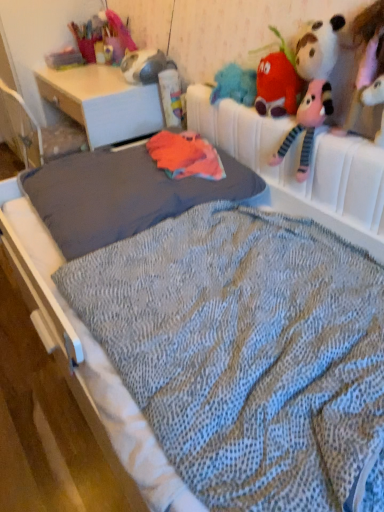
Describe the element at coordinates (278, 82) in the screenshot. I see `knitted plush strawberry at upper right, marked as the second toy in a right-to-left arrangement` at that location.

Find the location of a particular element. The height and width of the screenshot is (512, 384). matte white desk at center is located at coordinates (102, 102).

From the image's perspective, would you say knitted plush strawberry at upper right, which appears as the 2th toy when viewed from the front, is shown under gray fabric mattress at center?

Incorrect, from the image's perspective, knitted plush strawberry at upper right, which appears as the 2th toy when viewed from the front, is higher than gray fabric mattress at center.

Considering the relative positions of knitted plush strawberry at upper right, which appears as the 2th toy when viewed from the front, and gray fabric mattress at center in the image provided, is knitted plush strawberry at upper right, which appears as the 2th toy when viewed from the front, to the left of gray fabric mattress at center from the viewer's perspective?

In fact, knitted plush strawberry at upper right, which appears as the 2th toy when viewed from the front, is to the right of gray fabric mattress at center.

From a real-world perspective, is knitted plush strawberry at upper right, marked as the second toy in a right-to-left arrangement, above or below gray fabric mattress at center?

knitted plush strawberry at upper right, marked as the second toy in a right-to-left arrangement, is situated higher than gray fabric mattress at center in the real world.

This screenshot has width=384, height=512. What are the coordinates of `toy that appears behind the gray fabric mattress at center` in the screenshot? It's located at (278, 82).

From the image's perspective, is gray fabric mattress at center below knitted plush strawberry at upper right, which appears as the 2th toy when viewed from the front?

Yes.

Where is `mattress below the knitted plush strawberry at upper right, marked as the second toy in a right-to-left arrangement (from a real-world perspective)`? Image resolution: width=384 pixels, height=512 pixels. mattress below the knitted plush strawberry at upper right, marked as the second toy in a right-to-left arrangement (from a real-world perspective) is located at coordinates (122, 195).

Considering the relative positions of gray fabric mattress at center and knitted plush strawberry at upper right, which appears as the 2th toy when viewed from the front, in the image provided, is gray fabric mattress at center to the left or to the right of knitted plush strawberry at upper right, which appears as the 2th toy when viewed from the front,?

From the image, it's evident that gray fabric mattress at center is to the left of knitted plush strawberry at upper right, which appears as the 2th toy when viewed from the front.

Is gray fabric mattress at center positioned behind knitted plush strawberry at upper right, marked as the second toy in a right-to-left arrangement?

No, gray fabric mattress at center is closer to the camera.

In the scene shown: Is gray fabric mattress at center beside matte white desk at center?

No, gray fabric mattress at center is not in contact with matte white desk at center.

Which is more to the right, gray fabric mattress at center or matte white desk at center?

Positioned to the right is gray fabric mattress at center.

What's the angular difference between gray fabric mattress at center and matte white desk at center's facing directions?

There is a 7.9e-05-degree angle between the facing directions of gray fabric mattress at center and matte white desk at center.

Between gray fabric mattress at center and matte white desk at center, which one has smaller size?

gray fabric mattress at center.

Which object is positioned more to the left, matte white desk at center or gray fabric mattress at center?

matte white desk at center.

At what (x,y) coordinates should I click in order to perform the action: click on desk behind the gray fabric mattress at center. Please return your answer as a coordinate pair (x, y). The width and height of the screenshot is (384, 512). Looking at the image, I should click on 102,102.

Relative to gray fabric mattress at center, is matte white desk at center in front or behind?

matte white desk at center is behind gray fabric mattress at center.

Is point (63, 72) more distant than point (206, 186)?

Yes, it is.

Which object is more forward, white plush toy at upper right, acting as the 2th toy starting from the left, or knitted plush strawberry at upper right, which ranks as the 1th toy in back-to-front order?

white plush toy at upper right, acting as the 2th toy starting from the left, is in front.

From the image's perspective, is white plush toy at upper right, which is the 2th toy in back-to-front order, beneath knitted plush strawberry at upper right, marked as the second toy in a right-to-left arrangement?

Yes, from the image's perspective, white plush toy at upper right, which is the 2th toy in back-to-front order, is below knitted plush strawberry at upper right, marked as the second toy in a right-to-left arrangement.

Is point (379, 133) farther from camera compared to point (279, 87)?

No, it is not.

From a real-world perspective, between white plush toy at upper right, acting as the 2th toy starting from the left, and knitted plush strawberry at upper right, the first toy when ordered from left to right, who is vertically higher?

knitted plush strawberry at upper right, the first toy when ordered from left to right.

Considering the positions of point (166, 194) and point (365, 99), is point (166, 194) closer or farther from the camera than point (365, 99)?

Point (166, 194) appears to be farther away from the viewer than point (365, 99).

Between gray fabric mattress at center and white plush toy at upper right, acting as the 2th toy starting from the left, which one appears on the right side from the viewer's perspective?

Positioned to the right is white plush toy at upper right, acting as the 2th toy starting from the left.

Could you measure the distance between gray fabric mattress at center and white plush toy at upper right, which is the 2th toy in back-to-front order?

30.86 inches.

Consider the image. Would you say white plush toy at upper right, the 1th toy viewed from the front, is part of gray fabric mattress at center's contents?

No, gray fabric mattress at center does not contain white plush toy at upper right, the 1th toy viewed from the front.

Looking at their sizes, would you say knitted plush strawberry at upper right, marked as the second toy in a right-to-left arrangement, is wider or thinner than white plush toy at upper right, positioned as the 1th toy in right-to-left order?

In the image, knitted plush strawberry at upper right, marked as the second toy in a right-to-left arrangement, appears to be wider than white plush toy at upper right, positioned as the 1th toy in right-to-left order.

Is knitted plush strawberry at upper right, which ranks as the 1th toy in back-to-front order, taller or shorter than white plush toy at upper right, the 1th toy viewed from the front?

Considering their sizes, knitted plush strawberry at upper right, which ranks as the 1th toy in back-to-front order, has more height than white plush toy at upper right, the 1th toy viewed from the front.

Image resolution: width=384 pixels, height=512 pixels. Identify the location of toy below the knitted plush strawberry at upper right, the first toy when ordered from left to right (from a real-world perspective). (373, 93).

Would you say knitted plush strawberry at upper right, marked as the second toy in a right-to-left arrangement, is outside white plush toy at upper right, acting as the 2th toy starting from the left?

Indeed, knitted plush strawberry at upper right, marked as the second toy in a right-to-left arrangement, is completely outside white plush toy at upper right, acting as the 2th toy starting from the left.

You are a GUI agent. You are given a task and a screenshot of the screen. Output one action in this format:
    pyautogui.click(x=<x>, y=<y>)
    Task: Click on the toy behind the gray fabric mattress at center
    
    Given the screenshot: What is the action you would take?
    pyautogui.click(x=278, y=82)

Locate an element on the screen. mattress below the knitted plush strawberry at upper right, which ranks as the 1th toy in back-to-front order (from a real-world perspective) is located at coordinates (122, 195).

When comparing their distances from matte white desk at center, does white plush toy at upper right, which is the 2th toy in back-to-front order, or gray fabric mattress at center seem closer?

gray fabric mattress at center is positioned closer to the anchor matte white desk at center.

Consider the image. Considering their positions, is gray fabric mattress at center positioned further to white plush toy at upper right, acting as the 2th toy starting from the left, than knitted plush strawberry at upper right, marked as the second toy in a right-to-left arrangement?

gray fabric mattress at center.

Which object lies nearer to the anchor point white plush toy at upper right, positioned as the 1th toy in right-to-left order, knitted plush strawberry at upper right, the first toy when ordered from left to right, or matte white desk at center?

knitted plush strawberry at upper right, the first toy when ordered from left to right.

Based on the photo, looking at the image, which one is located closer to knitted plush strawberry at upper right, which appears as the 2th toy when viewed from the front, white plush toy at upper right, acting as the 2th toy starting from the left, or matte white desk at center?

Among the two, white plush toy at upper right, acting as the 2th toy starting from the left, is located nearer to knitted plush strawberry at upper right, which appears as the 2th toy when viewed from the front.

Considering their positions, is matte white desk at center positioned further to white plush toy at upper right, the 1th toy viewed from the front, than gray fabric mattress at center?

matte white desk at center is further to white plush toy at upper right, the 1th toy viewed from the front.

Considering their positions, is white plush toy at upper right, acting as the 2th toy starting from the left, positioned further to gray fabric mattress at center than knitted plush strawberry at upper right, which appears as the 2th toy when viewed from the front?

Among the two, white plush toy at upper right, acting as the 2th toy starting from the left, is located further to gray fabric mattress at center.

From the picture: When comparing their distances from knitted plush strawberry at upper right, marked as the second toy in a right-to-left arrangement, does matte white desk at center or gray fabric mattress at center seem further?

Among the two, matte white desk at center is located further to knitted plush strawberry at upper right, marked as the second toy in a right-to-left arrangement.

Looking at the image, which one is located closer to matte white desk at center, knitted plush strawberry at upper right, which ranks as the 1th toy in back-to-front order, or white plush toy at upper right, positioned as the 1th toy in right-to-left order?

The object closer to matte white desk at center is knitted plush strawberry at upper right, which ranks as the 1th toy in back-to-front order.

Locate an element on the screen. The width and height of the screenshot is (384, 512). toy located between matte white desk at center and white plush toy at upper right, the 1th toy viewed from the front, in the left-right direction is located at coordinates 278,82.

Where is `mattress between matte white desk at center and white plush toy at upper right, positioned as the 1th toy in right-to-left order, from left to right`? This screenshot has width=384, height=512. mattress between matte white desk at center and white plush toy at upper right, positioned as the 1th toy in right-to-left order, from left to right is located at coordinates (122, 195).

I want to click on mattress between matte white desk at center and knitted plush strawberry at upper right, the first toy when ordered from left to right, in the horizontal direction, so click(122, 195).

You are a GUI agent. You are given a task and a screenshot of the screen. Output one action in this format:
    pyautogui.click(x=<x>, y=<y>)
    Task: Click on the toy between gray fabric mattress at center and white plush toy at upper right, acting as the 2th toy starting from the left
    This screenshot has width=384, height=512.
    Given the screenshot: What is the action you would take?
    pyautogui.click(x=278, y=82)